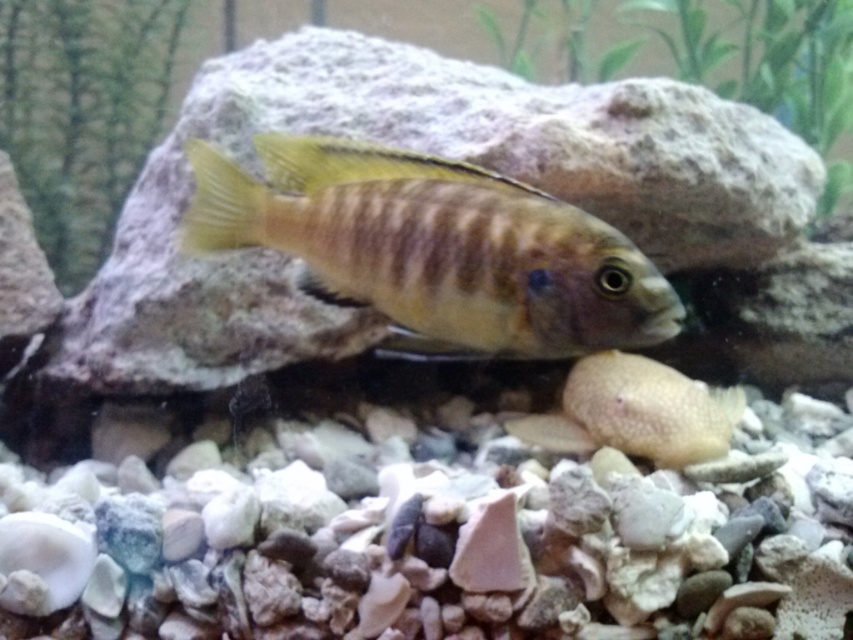
Question: Does shiny brown fish at center lie behind smooth beige rock at center?

Choices:
 (A) yes
 (B) no

Answer: (B)

Question: Is shiny brown fish at center positioned at the back of smooth beige rock at center?

Choices:
 (A) yes
 (B) no

Answer: (B)

Question: Is shiny brown fish at center to the left of smooth beige rock at center from the viewer's perspective?

Choices:
 (A) yes
 (B) no

Answer: (A)